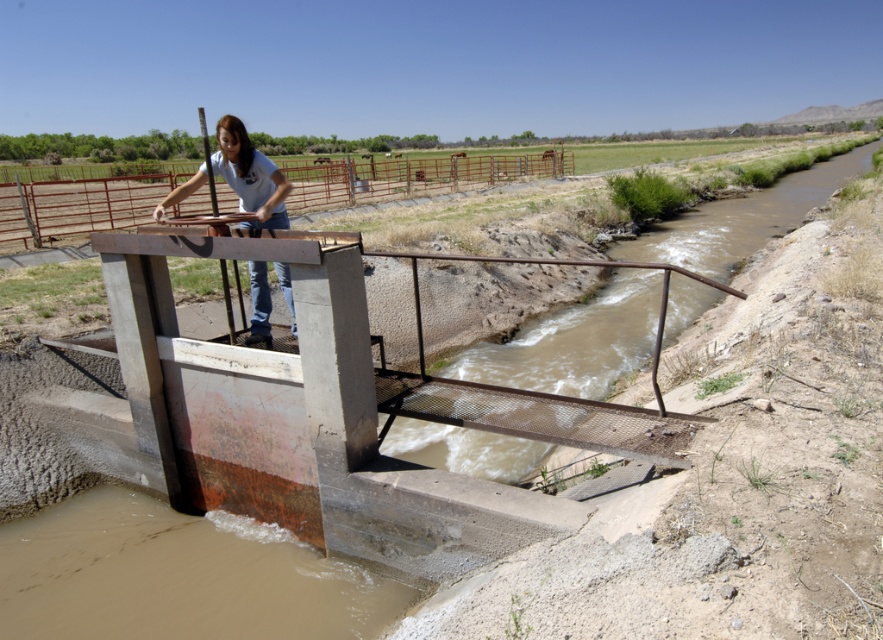
Between brown concrete stream at center and rusty metal rail at upper center, which one appears on the right side from the viewer's perspective?

brown concrete stream at center is more to the right.

Does brown concrete stream at center lie in front of rusty metal rail at upper center?

Yes, it is in front of rusty metal rail at upper center.

Is point (522, 333) positioned in front of point (76, 184)?

Yes, point (522, 333) is in front of point (76, 184).

This screenshot has width=883, height=640. Identify the location of brown concrete stream at center. (572, 342).

Does rusty metal rail at upper center appear over matte blue shirt at center?

Yes, rusty metal rail at upper center is above matte blue shirt at center.

Is rusty metal rail at upper center wider than matte blue shirt at center?

Result: Yes, rusty metal rail at upper center is wider than matte blue shirt at center.

Locate an element on the screen. This screenshot has width=883, height=640. rusty metal rail at upper center is located at coordinates (416, 176).

Identify the location of rusty metal rail at upper center. The height and width of the screenshot is (640, 883). (416, 176).

Image resolution: width=883 pixels, height=640 pixels. Find the location of `brown concrete stream at center`. brown concrete stream at center is located at coordinates (572, 342).

Who is lower down, brown concrete stream at center or matte blue shirt at center?

matte blue shirt at center is below.

The image size is (883, 640). What do you see at coordinates (572, 342) in the screenshot?
I see `brown concrete stream at center` at bounding box center [572, 342].

Where is `brown concrete stream at center`? This screenshot has height=640, width=883. brown concrete stream at center is located at coordinates (572, 342).